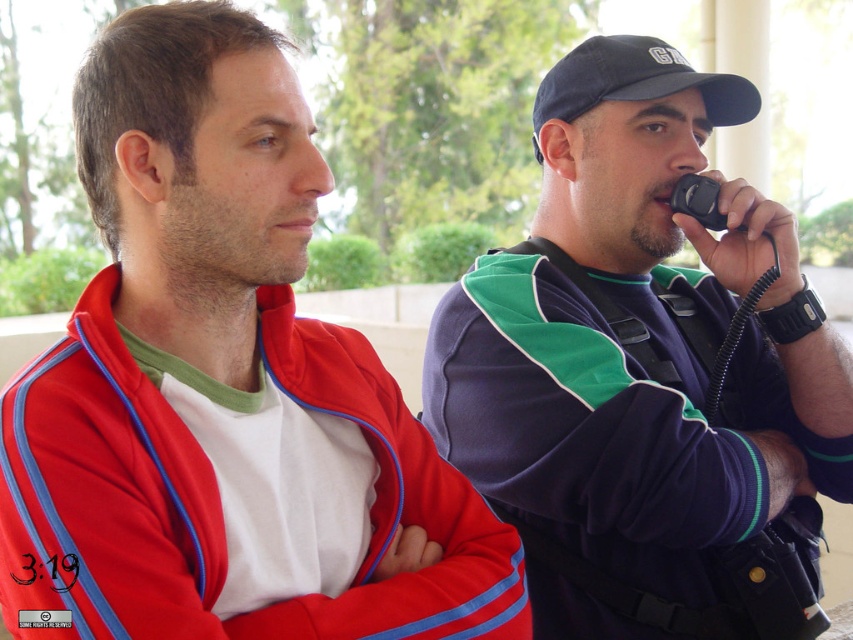
Which is more to the right, black rubber walkie-talkie at right or black plastic phone at right?

From the viewer's perspective, black rubber walkie-talkie at right appears more on the right side.

Which of these two, black rubber walkie-talkie at right or black plastic phone at right, stands shorter?

With less height is black plastic phone at right.

Does point (776, 444) come farther from viewer compared to point (706, 202)?

No, it is in front of (706, 202).

Identify the location of black rubber walkie-talkie at right. The width and height of the screenshot is (853, 640). (747, 243).

Between navy blue/green fabric jacket at right and black rubber walkie-talkie at right, which one appears on the right side from the viewer's perspective?

From the viewer's perspective, black rubber walkie-talkie at right appears more on the right side.

Who is higher up, navy blue/green fabric jacket at right or black rubber walkie-talkie at right?

navy blue/green fabric jacket at right is above.

Is point (575, 120) less distant than point (740, 252)?

No, it is behind (740, 252).

Where is `navy blue/green fabric jacket at right`? The height and width of the screenshot is (640, 853). navy blue/green fabric jacket at right is located at coordinates (643, 372).

How distant is matte red jacket at center from black plastic phone at right?

They are 1.35 meters apart.

Can you confirm if matte red jacket at center is smaller than black plastic phone at right?

A: No, matte red jacket at center is not smaller than black plastic phone at right.

Who is more distant from viewer, (199, 324) or (688, 202)?

The point (688, 202) is more distant.

Where is `matte red jacket at center`? matte red jacket at center is located at coordinates (223, 388).